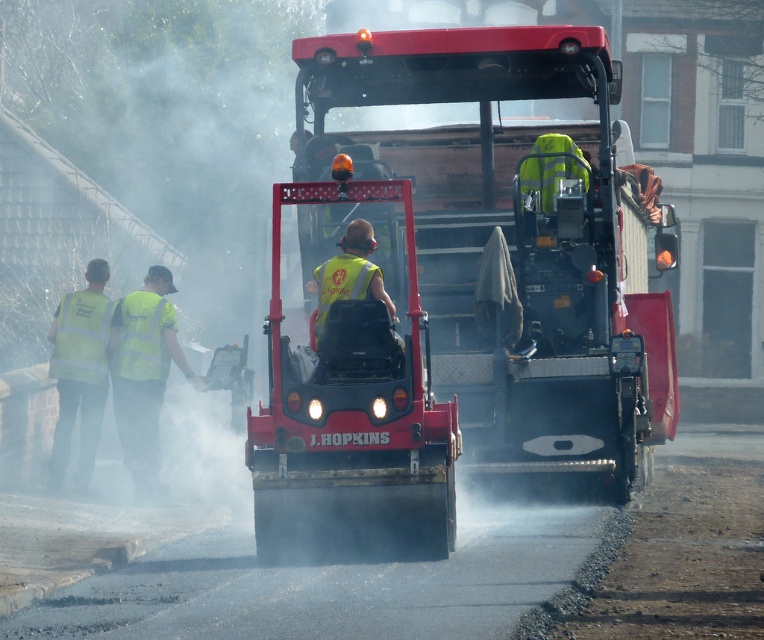
You are a construction supervisor checking the layout of the equipment. The matte red asphalt compactor at center needs to move forward to compact the newly laid asphalt. Will the yellow reflective vest at center interfere with its movement? Please explain based on their positions.

The matte red asphalt compactor at center is located above the yellow reflective vest at center, meaning the vest is positioned behind or to the side of the compactor. Therefore, moving the compactor forward should not interfere with the vest as it is already positioned behind or to the side of the machine.

You are a safety inspector checking the visibility of workers in the construction scene. You notice two workers at the left edge of the road wearing yellow reflective vest at left and high visibility vest at left. Which worker is wearing a wider vest?

The yellow reflective vest at left is wider than the high visibility vest at left.

You are a safety inspector checking the construction site. You notice two safety vests on the workers. Which vest has a wider width, the high visibility vest at left or the bright yellow reflective safety vest at center?

The bright yellow reflective safety vest at center has a wider width than the high visibility vest at left.